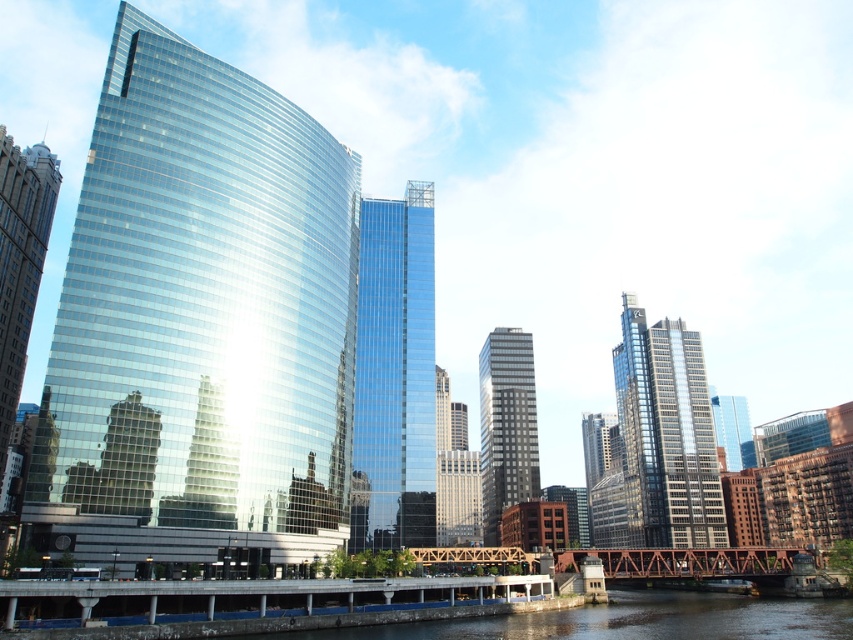
Question: Which of the following is the farthest from the observer?

Choices:
 (A) rusty steel bridge at lower center
 (B) shiny glass skyscraper at center
 (C) glossy glass skyscraper at center

Answer: (B)

Question: Is shiny glass skyscraper at left bigger than glossy glass skyscraper at center?

Choices:
 (A) yes
 (B) no

Answer: (A)

Question: Which point is farther to the camera?

Choices:
 (A) shiny glass skyscraper at center
 (B) silver glass skyscraper at center
 (C) shiny glass skyscraper at left

Answer: (A)

Question: Is glossy glass skyscraper at center to the left of silver glass skyscraper at center from the viewer's perspective?

Choices:
 (A) yes
 (B) no

Answer: (A)

Question: Which object is closer to the camera taking this photo?

Choices:
 (A) silver glass skyscraper at center
 (B) rusty steel bridge at lower center
 (C) shiny glass skyscraper at left
 (D) glossy glass skyscraper at center

Answer: (C)

Question: Does shiny glass skyscraper at center have a larger size compared to rusty steel bridge at lower center?

Choices:
 (A) yes
 (B) no

Answer: (B)